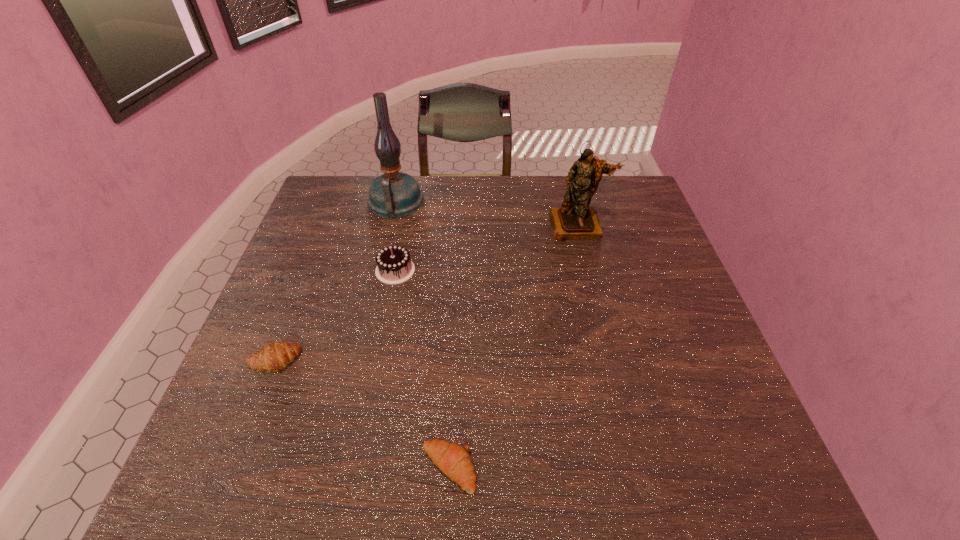
Image resolution: width=960 pixels, height=540 pixels. What are the coordinates of `vacant space at the far edge` in the screenshot? It's located at (426, 207).

The height and width of the screenshot is (540, 960). In the image, there is a desktop. In order to click on vacant space at the near edge in this screenshot , I will do `click(545, 473)`.

Find the location of a particular element. free space at the left edge of the desktop is located at coordinates (295, 374).

The height and width of the screenshot is (540, 960). In the image, there is a desktop. What are the coordinates of `vacant space at the right edge` in the screenshot? It's located at (654, 240).

Find the location of `vacant space at the far right corner`. vacant space at the far right corner is located at coordinates point(637,195).

You are a GUI agent. You are given a task and a screenshot of the screen. Output one action in this format:
    pyautogui.click(x=<x>, y=<y>)
    Task: Click on the free space between the figurine and the third shortest object
    The image size is (960, 540).
    Given the screenshot: What is the action you would take?
    pyautogui.click(x=487, y=248)

Where is `free space between the farther crescent roll and the right crescent roll`? This screenshot has width=960, height=540. free space between the farther crescent roll and the right crescent roll is located at coordinates (361, 415).

Identify the location of empty location between the rightmost object and the farther crescent roll. Image resolution: width=960 pixels, height=540 pixels. (425, 293).

I want to click on free space between the third shortest object and the farther crescent roll, so click(334, 316).

Identify the location of free space between the farther crescent roll and the oil lamp. Image resolution: width=960 pixels, height=540 pixels. (335, 281).